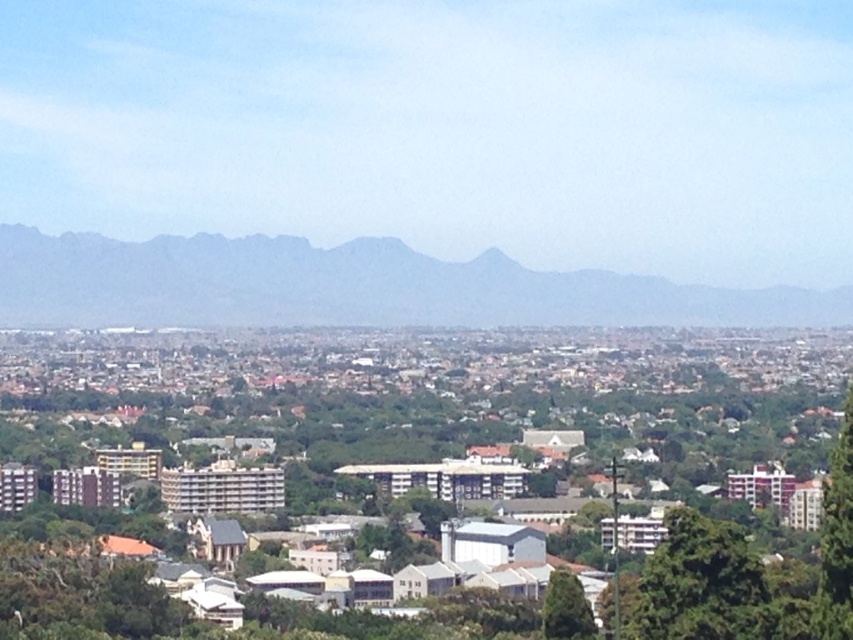
Does point (1, 228) come in front of point (558, 586)?

No, it is behind (558, 586).

This screenshot has height=640, width=853. I want to click on gray rocky mountain at center, so click(x=352, y=288).

Does gray rocky mountain at center appear on the left side of green leafy tree at right?

Correct, you'll find gray rocky mountain at center to the left of green leafy tree at right.

Is gray rocky mountain at center wider than green leafy tree at right?

Yes.

Image resolution: width=853 pixels, height=640 pixels. What do you see at coordinates (352, 288) in the screenshot?
I see `gray rocky mountain at center` at bounding box center [352, 288].

Locate an element on the screen. gray rocky mountain at center is located at coordinates (352, 288).

Which of these two, green leafy tree at lower right or green leafy tree at right, stands shorter?

green leafy tree at lower right is shorter.

Is green leafy tree at lower right shorter than green leafy tree at right?

Yes.

Does point (656, 554) lie in front of point (838, 560)?

Yes, point (656, 554) is closer to viewer.

Where is `green leafy tree at lower right`? This screenshot has height=640, width=853. green leafy tree at lower right is located at coordinates (700, 584).